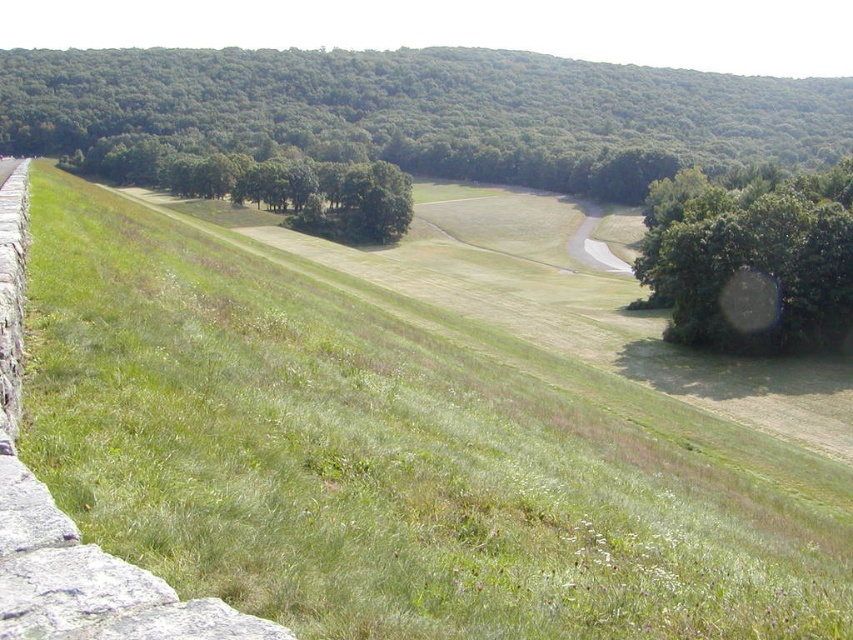
Between point (39, 252) and point (689, 102), which one is positioned behind?

The point (689, 102) is more distant.

From the picture: Is green grassy slope at left taller than green leafy tree at center?

Incorrect, green grassy slope at left's height is not larger of green leafy tree at center's.

Is point (646, 509) closer to viewer compared to point (680, 74)?

Yes, it is.

Identify the location of green grassy slope at left. (393, 456).

Can you confirm if green leafy tree at center is bigger than green leafy tree at center right?

Correct, green leafy tree at center is larger in size than green leafy tree at center right.

Is point (775, 106) closer to camera compared to point (747, 200)?

No, (775, 106) is behind (747, 200).

Locate an element on the screen. The width and height of the screenshot is (853, 640). green leafy tree at center is located at coordinates (428, 109).

Does point (358, 372) come farther from viewer compared to point (840, 208)?

No, it is in front of (840, 208).

Is point (282, 570) positioned in front of point (724, 192)?

That is True.

Does point (839, 604) come behind point (698, 298)?

No.

What are the coordinates of `green grassy slope at left` in the screenshot? It's located at (393, 456).